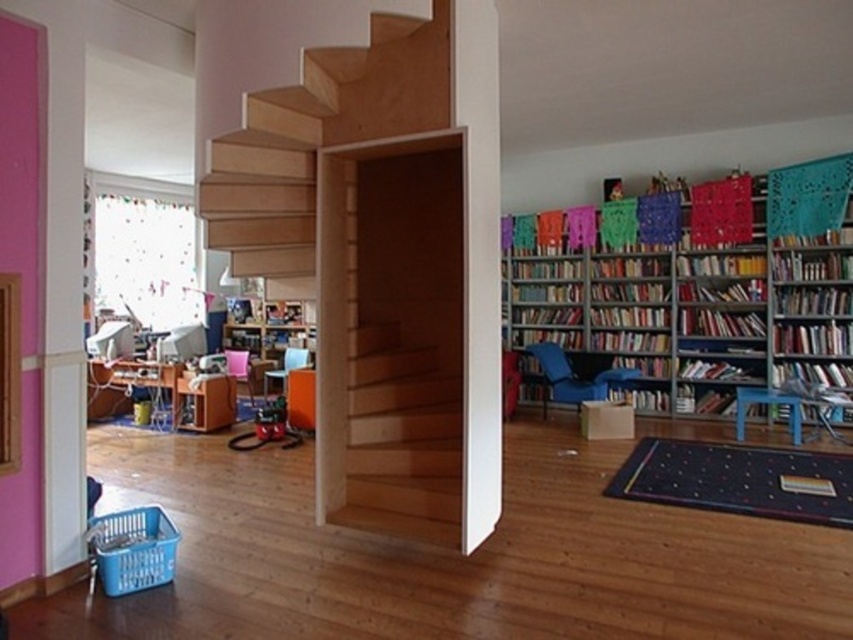
Question: Does metallic silver bookcase at right appear under wooden stairs at center?

Choices:
 (A) no
 (B) yes

Answer: (B)

Question: Which object appears farthest from the camera in this image?

Choices:
 (A) metallic silver bookcase at right
 (B) hardcover book at right

Answer: (B)

Question: Among these points, which one is nearest to the camera?

Choices:
 (A) (834, 348)
 (B) (846, 301)

Answer: (B)

Question: Which point is closer to the camera taking this photo?

Choices:
 (A) (376, 35)
 (B) (583, 314)
 (C) (831, 308)
 (D) (775, 326)

Answer: (A)

Question: Is wooden stairs at center wider than hardcover book at upper right?

Choices:
 (A) yes
 (B) no

Answer: (A)

Question: Is metallic silver bookcase at right below hardcover book at right?

Choices:
 (A) no
 (B) yes

Answer: (A)